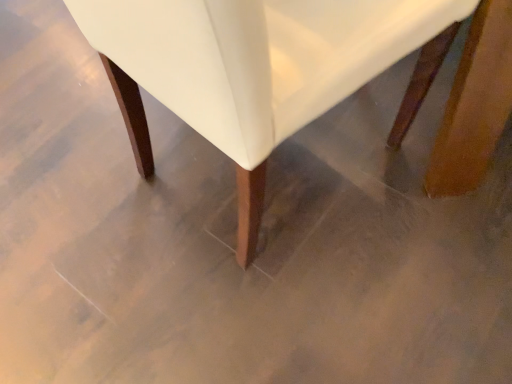
This screenshot has height=384, width=512. I want to click on vacant space to the right of matte white chair at center, so click(424, 206).